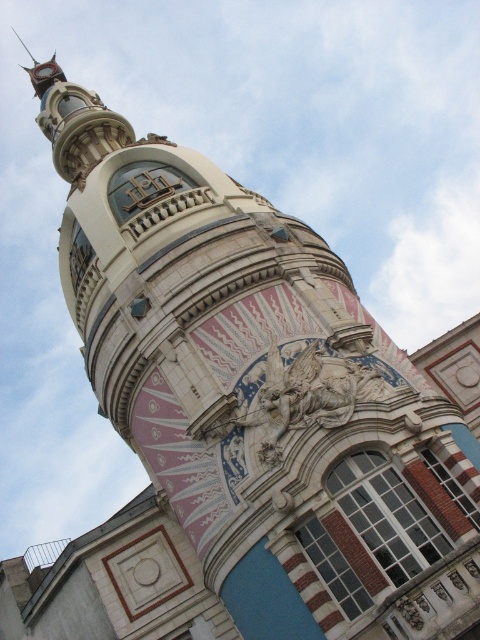
Looking at this image, you are standing in front of the ornate building and want to locate two specific points marked on the facade. The first point is at coordinate point [252,449] and the second is at point [44,61]. Which of these points is closer to you?

Point [252,449] is in front of point [44,61], so it is closer to you.

You are an architect examining the building. You need to install a new light fixture between the carved stone sculpture at center and the polished brass clock at upper left. Based on their positions, where should you place the new light fixture?

The carved stone sculpture at center is positioned under the polished brass clock at upper left, so the new light fixture should be placed between them, below the clock and above the sculpture.

You are an architect analyzing the building facade. You need to determine which object takes up more visual space on the facade between the carved stone sculpture at center and the polished brass clock at upper left. Which one is larger?

The polished brass clock at upper left takes up more visual space than the carved stone sculpture at center because the carved stone sculpture at center occupies less space than polished brass clock at upper left.